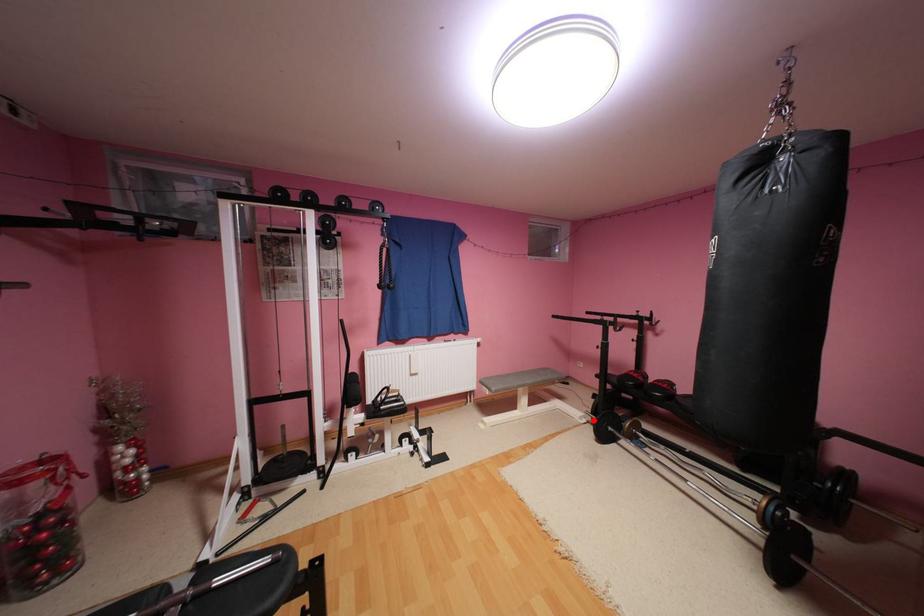
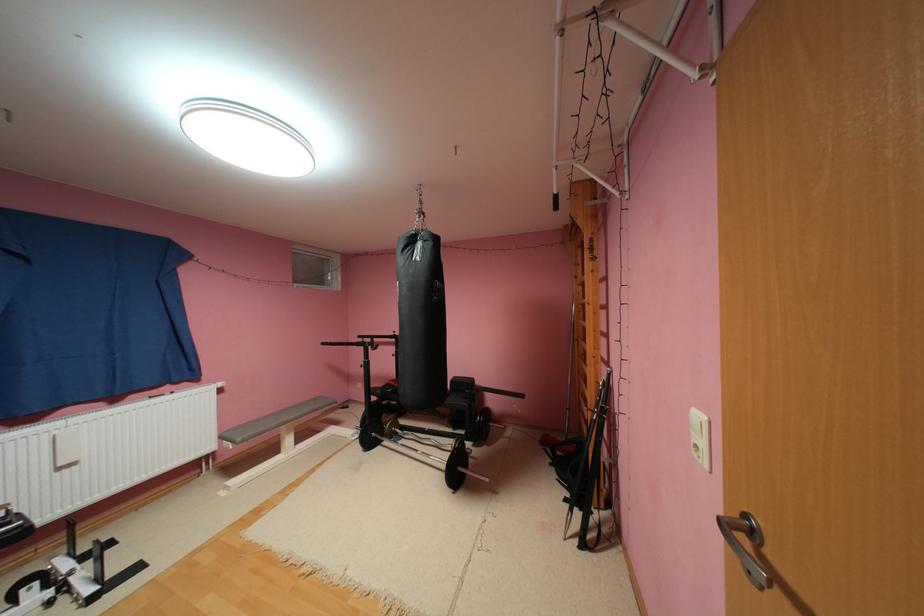
In the second image, find the point that corresponds to the highlighted location in the first image.

(366, 436)